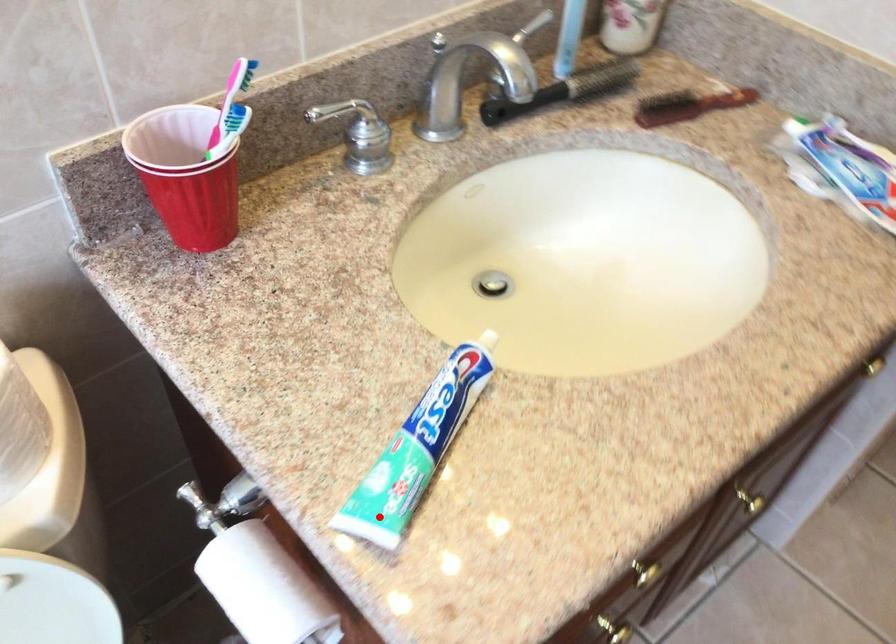
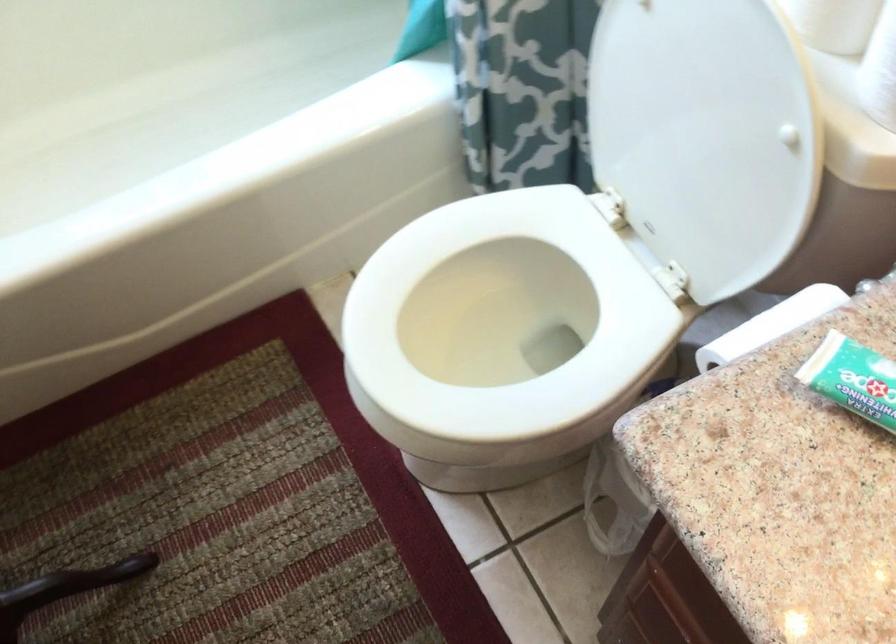
In the second image, find the point that corresponds to the highlighted location in the first image.

(853, 379)